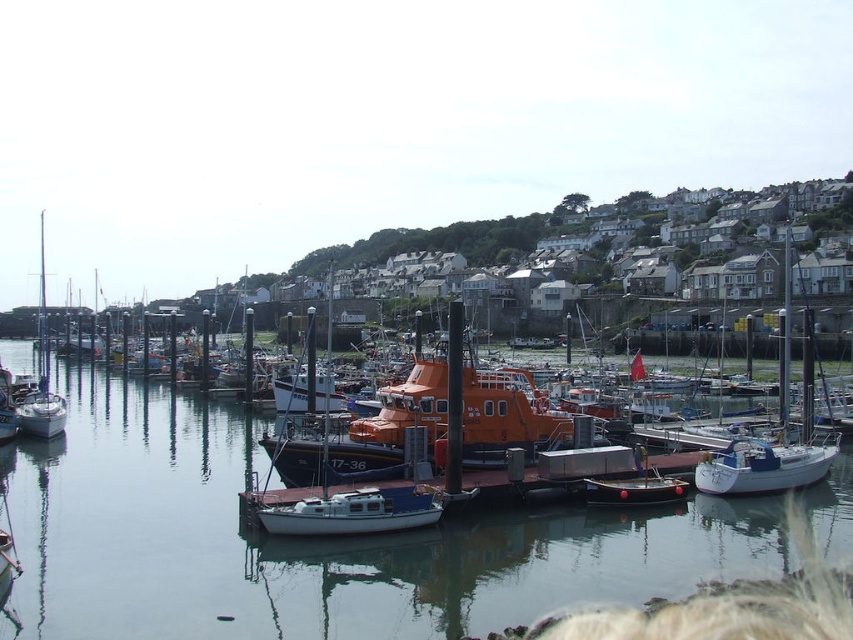
Question: Which object appears closest to the camera in this image?

Choices:
 (A) wooden polished boat at center
 (B) white glossy sailboat at right
 (C) smooth water at center

Answer: (C)

Question: From the image, what is the correct spatial relationship of white glossy sailboat at right in relation to white matte sailboat at left?

Choices:
 (A) left
 (B) right

Answer: (B)

Question: Which object is positioned closest to the white glossy sailboat at right?

Choices:
 (A) smooth water at center
 (B) white matte sailboat at left
 (C) wooden polished boat at center

Answer: (A)

Question: Can you confirm if white glossy sailboat at right is positioned to the right of wooden polished boat at center?

Choices:
 (A) yes
 (B) no

Answer: (A)

Question: Is smooth water at center below wooden polished boat at center?

Choices:
 (A) yes
 (B) no

Answer: (B)

Question: Which object is farther from the camera taking this photo?

Choices:
 (A) smooth water at center
 (B) white glossy sailboat at right
 (C) white matte sailboat at left
 (D) wooden polished boat at center

Answer: (C)